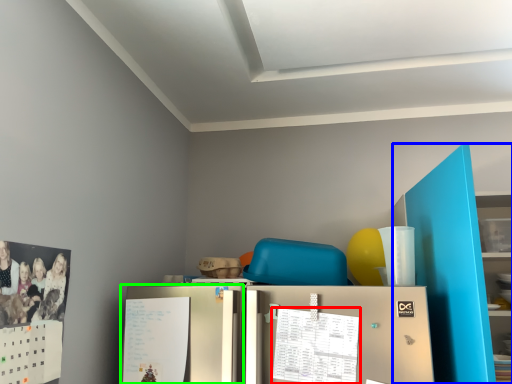
Question: Based on their relative distances, which object is farther from calendar (highlighted by a red box)? Choose from bookshelf (highlighted by a blue box) and fridge (highlighted by a green box).

Choices:
 (A) bookshelf
 (B) fridge

Answer: (A)